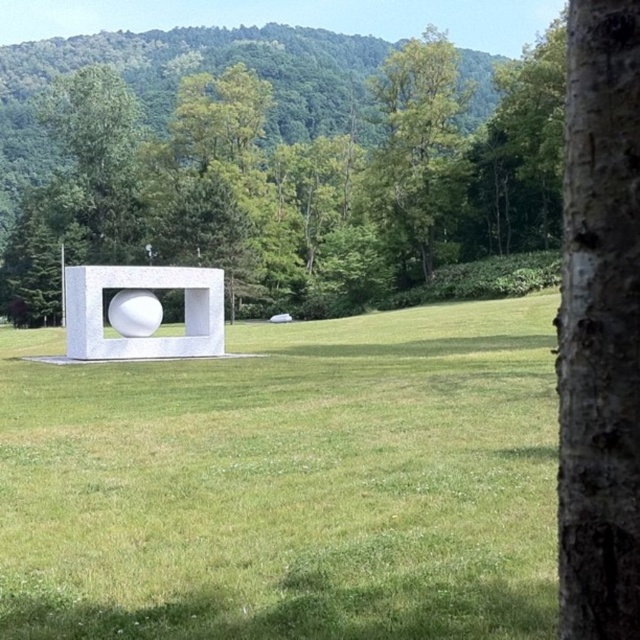
You are standing in the grassy area and want to take a photo of the sculpture without the tree trunk blocking the view. Based on the coordinates provided, is the tree trunk at point (x=600, y=326) positioned to the right of the sculpture?

The bark textured tree trunk at right is represented by point (x=600, y=326). Since the tree trunk is at the right side of the image, it is positioned to the right of the sculpture, which is centrally located. Therefore, the tree trunk at point (x=600, y=326) is indeed to the right of the sculpture.